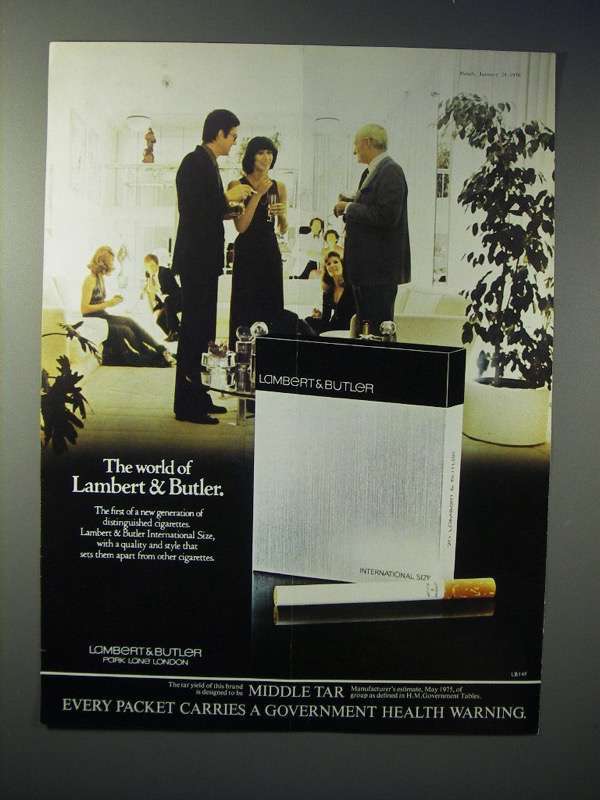
Locate an element on the screen. This screenshot has width=600, height=800. carpet is located at coordinates (130, 408).